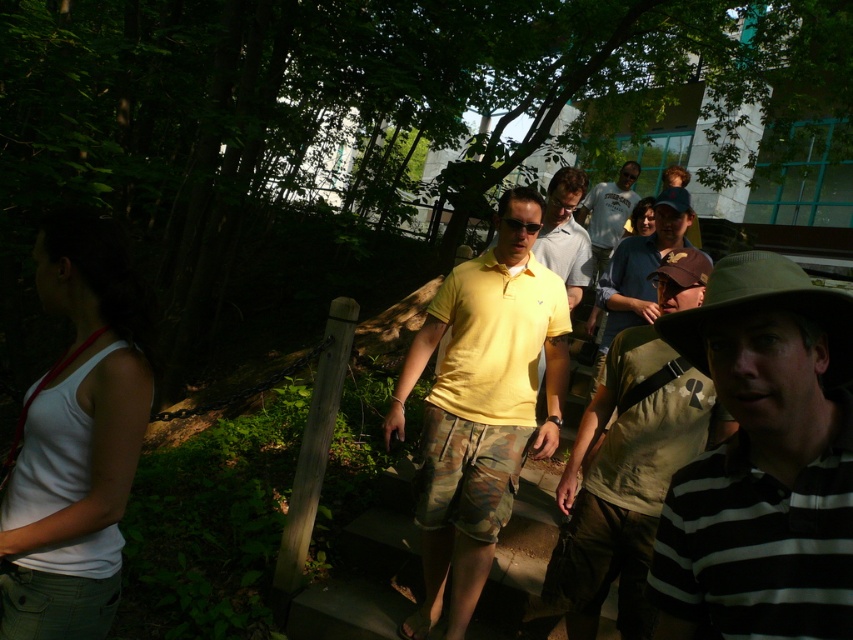
You are standing at the center of the image and want to locate the black striped polo shirt at right. According to the coordinates provided, in which direction should you look to find it?

The black striped polo shirt at right is located at coordinates point (762,461). Since the x coordinate is 0.723, which is greater than 0.5, you should look to the right side of the image to find it.